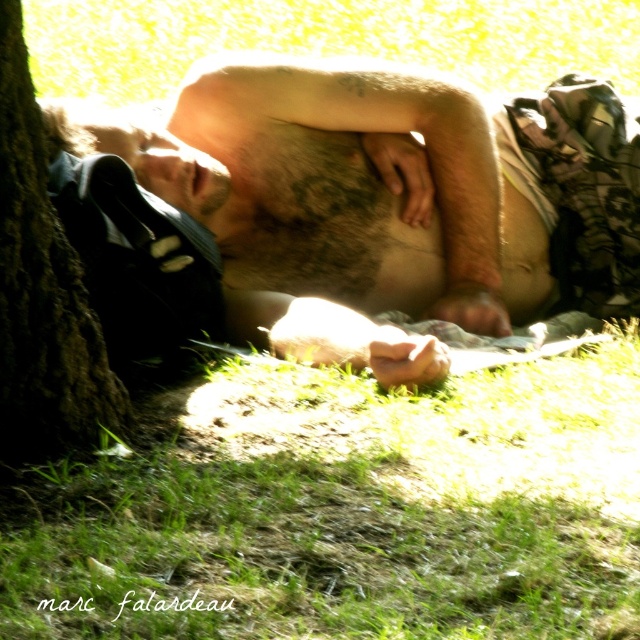
Based on the scene description, can you determine which object, the hairy skin at center or the brown rough bark at left, has a greater height in the image?

The hairy skin at center is much taller than the brown rough bark at left according to the description.

You are standing at the point marked as point (348, 512). Looking around, you see green grass at lower center. What is directly beneath your feet?

The point (348, 512) is where the green grass at lower center is located, so the green grass at lower center is directly beneath your feet.

You are a photographer trying to capture the person resting under the tree. You notice the green grass at lower center and the brown rough bark at left. Which object is closer to the camera lens based on their height?

The green grass at lower center is shorter than brown rough bark at left, so the brown rough bark at left is taller and thus closer to the camera lens.